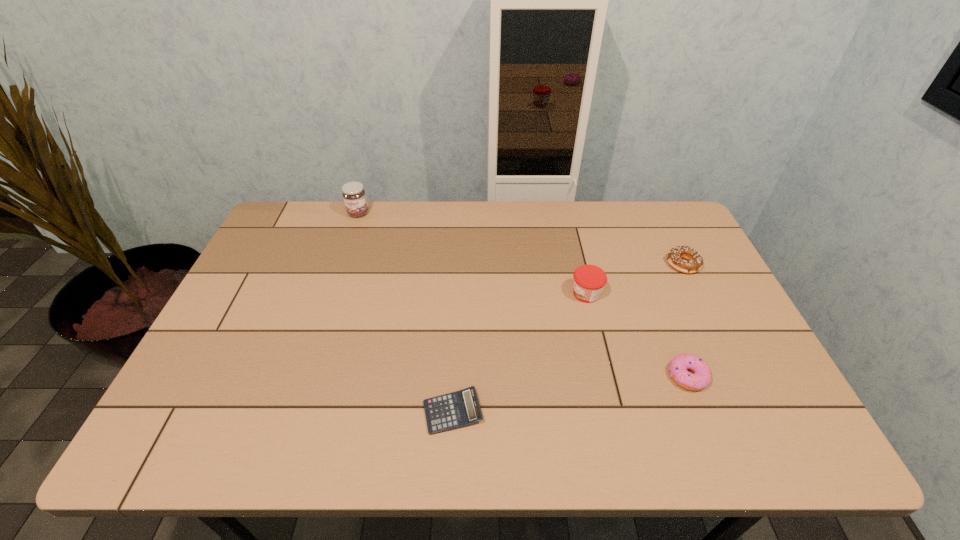
Identify the location of vacant space situated 0.190m on the front label of the leftmost object. Image resolution: width=960 pixels, height=540 pixels. (344, 255).

Identify the location of free region located 0.280m on the label side of the second tallest object. The image size is (960, 540). (474, 294).

I want to click on vacant area situated 0.130m on the label side of the second tallest object, so click(x=525, y=294).

At what (x,y) coordinates should I click in order to perform the action: click on vacant region located on the label side of the second tallest object. Please return your answer as a coordinate pair (x, y). Looking at the image, I should click on (464, 294).

Find the location of `vacant space situated on the left of the farther doughnut`. vacant space situated on the left of the farther doughnut is located at coordinates (615, 264).

This screenshot has height=540, width=960. In order to click on vacant region located 0.070m on the left of the nearer doughnut in this screenshot , I will do `click(640, 376)`.

Find the location of a particular element. The width and height of the screenshot is (960, 540). vacant space located on the back of the fourth object from right to left is located at coordinates (457, 328).

This screenshot has height=540, width=960. I want to click on object present at the far edge, so click(x=353, y=193).

The height and width of the screenshot is (540, 960). In order to click on object that is positioned at the near edge in this screenshot , I will do `click(461, 408)`.

In the image, there is a desktop. Identify the location of vacant space at the far edge. This screenshot has height=540, width=960. (497, 231).